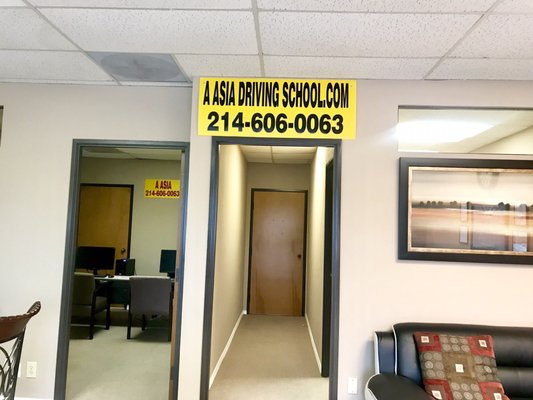
Where is `vent`? vent is located at coordinates (161, 71).